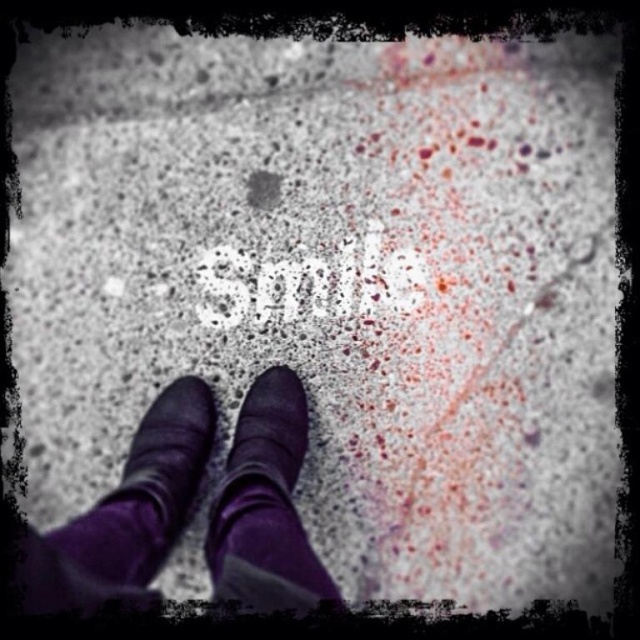
Question: Estimate the real-world distances between objects in this image. Which object is farther from the white speckled paper at center?

Choices:
 (A) purple suede boot at lower center
 (B) purple suede sock at center
 (C) purple suede boots at center

Answer: (A)

Question: Observing the image, what is the correct spatial positioning of purple suede boot at lower center in reference to white speckled paper at center?

Choices:
 (A) left
 (B) right

Answer: (A)

Question: Which point is closer to the camera taking this photo?

Choices:
 (A) (99, 573)
 (B) (216, 556)

Answer: (A)

Question: Can you confirm if purple suede sock at center is bigger than purple suede boot at lower center?

Choices:
 (A) yes
 (B) no

Answer: (B)

Question: Does purple suede boots at center appear over purple suede sock at center?

Choices:
 (A) yes
 (B) no

Answer: (B)

Question: Which point appears closest to the camera in this image?

Choices:
 (A) (292, 461)
 (B) (220, 272)
 (C) (317, 600)

Answer: (C)